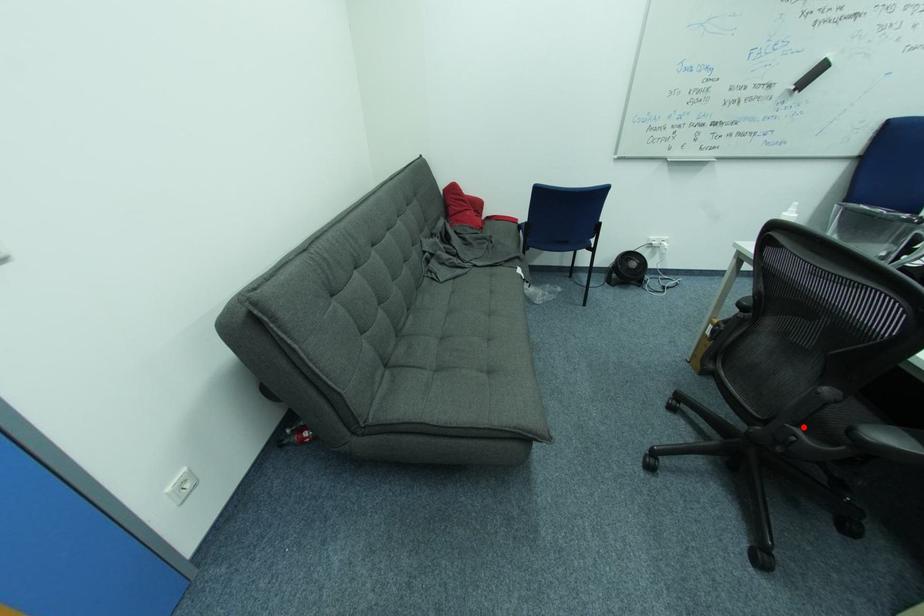
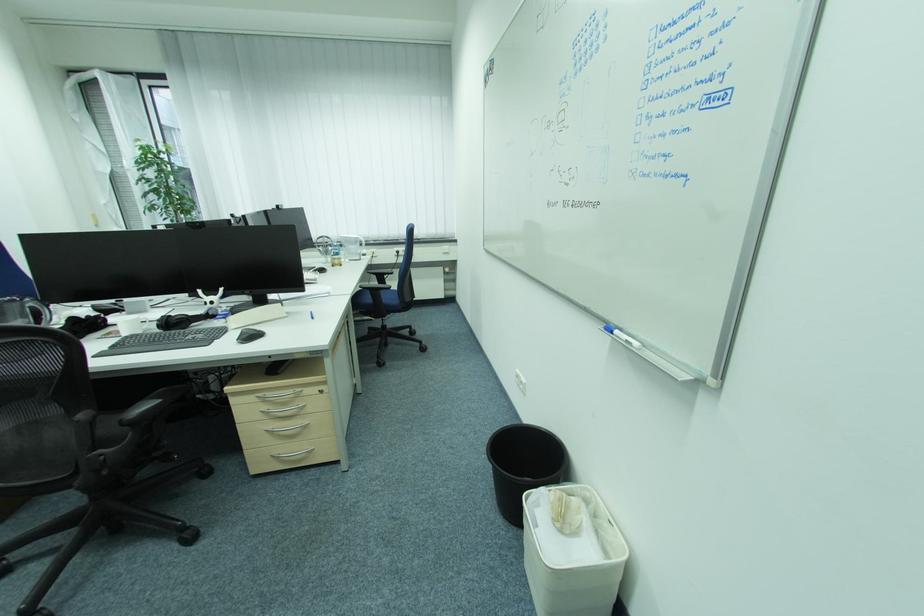
Locate, in the second image, the point that corresponds to the highlighted location in the first image.

(102, 452)